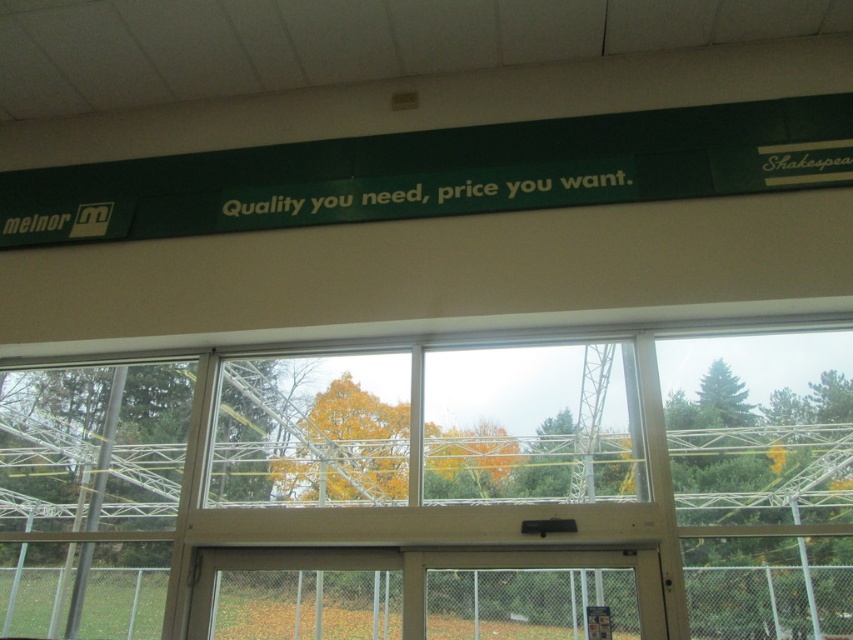
Question: Can you confirm if transparent glass window at center is positioned to the right of green matte signboard at upper center?

Choices:
 (A) no
 (B) yes

Answer: (A)

Question: Among these objects, which one is nearest to the camera?

Choices:
 (A) green matte signboard at upper center
 (B) transparent glass window at center

Answer: (B)

Question: Which of the following is the farthest from the observer?

Choices:
 (A) transparent glass window at center
 (B) green matte signboard at upper center

Answer: (B)

Question: Is transparent glass window at center further to the viewer compared to green matte signboard at upper center?

Choices:
 (A) no
 (B) yes

Answer: (A)

Question: Is transparent glass window at center bigger than green matte signboard at upper center?

Choices:
 (A) yes
 (B) no

Answer: (A)